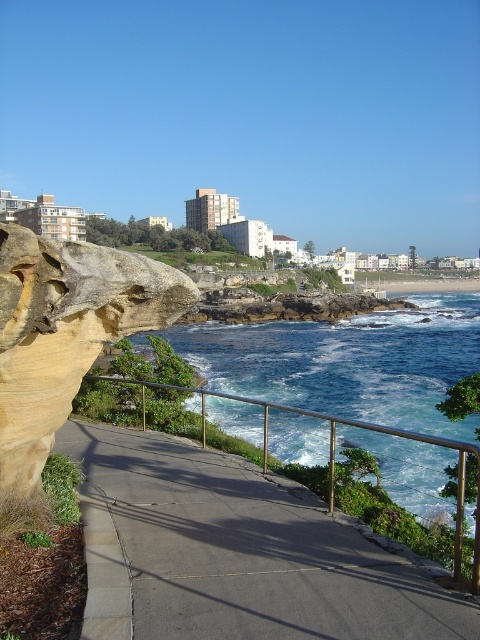
Is yellow sandstone rock at left to the right of metal/rustic rail at center from the viewer's perspective?

In fact, yellow sandstone rock at left is to the left of metal/rustic rail at center.

Which is in front, point (95, 272) or point (472, 564)?

Point (472, 564) is more forward.

Identify the location of yellow sandstone rock at left. (64, 333).